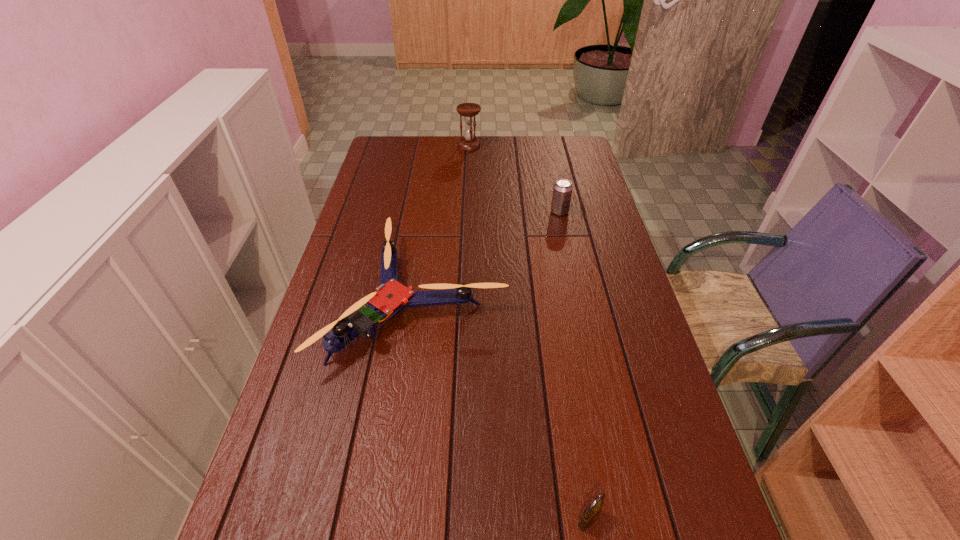
Where is `the tallest object`? The image size is (960, 540). the tallest object is located at coordinates (469, 110).

This screenshot has height=540, width=960. Identify the location of the farthest object. (469, 110).

Where is `beer can`? The width and height of the screenshot is (960, 540). beer can is located at coordinates (562, 191).

Locate an element on the screen. The height and width of the screenshot is (540, 960). the rightmost object is located at coordinates (562, 191).

You are a GUI agent. You are given a task and a screenshot of the screen. Output one action in this format:
    pyautogui.click(x=<x>, y=<y>)
    Task: Click on the third farthest object
    
    Given the screenshot: What is the action you would take?
    pyautogui.click(x=391, y=297)

The height and width of the screenshot is (540, 960). Find the location of `the third object from left to right`. the third object from left to right is located at coordinates (589, 516).

Identify the location of the nearest object. This screenshot has width=960, height=540. (589, 516).

You are a GUI agent. You are given a task and a screenshot of the screen. Output one action in this format:
    pyautogui.click(x=<x>, y=<y>)
    Task: Click on the vacant area situated on the left of the farthest object
    The image size is (960, 540).
    Given the screenshot: What is the action you would take?
    pyautogui.click(x=408, y=146)

Where is `vacant region located 0.360m on the back of the beer can`? The image size is (960, 540). vacant region located 0.360m on the back of the beer can is located at coordinates (547, 155).

Find the location of a particular element. The width and height of the screenshot is (960, 540). vacant region located 0.250m on the back of the second nearest object is located at coordinates (434, 194).